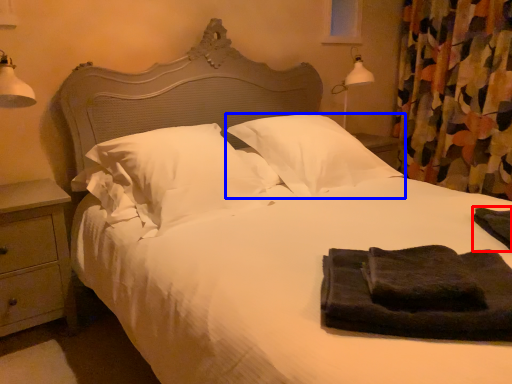
Question: Which of the following is the farthest to the observer, material (highlighted by a red box) or pillow (highlighted by a blue box)?

Choices:
 (A) material
 (B) pillow

Answer: (B)